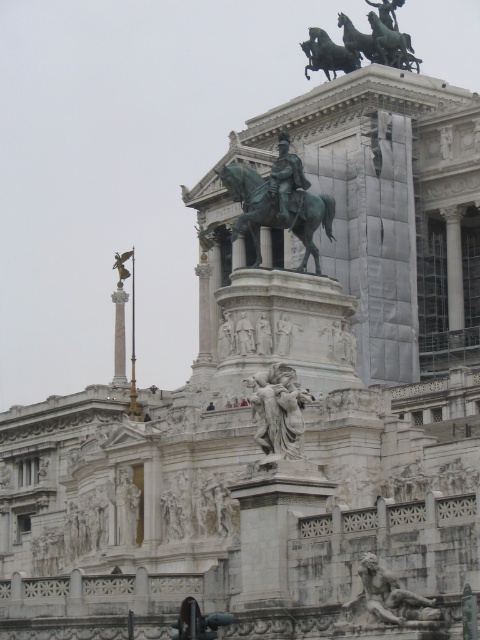
Question: Does bronze/golden statue at center appear under bronze statue at center?

Choices:
 (A) yes
 (B) no

Answer: (A)

Question: Among these objects, which one is farthest from the camera?

Choices:
 (A) polished stone statue at center
 (B) bronze statue at lower right
 (C) green patina bronze chariot at upper center
 (D) green polished bronze horse at upper center

Answer: (D)

Question: Estimate the real-world distances between objects in this image. Which object is closer to the green polished bronze horse at upper center?

Choices:
 (A) polished stone statue at center
 (B) bronze statue at center
 (C) bronze statue at lower right

Answer: (B)

Question: Which point is farther from the camera taking this photo?

Choices:
 (A) (336, 67)
 (B) (400, 54)
 (C) (295, 225)
 (D) (286, 138)

Answer: (A)

Question: Is bronze statue at center smaller than green polished bronze horse at upper center?

Choices:
 (A) yes
 (B) no

Answer: (B)

Question: Does bronze/golden statue at center appear under bronze statue at center?

Choices:
 (A) yes
 (B) no

Answer: (A)